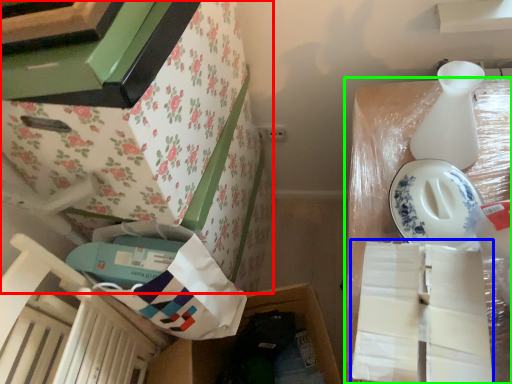
Question: Considering the real-world distances, which object is farthest from furniture (highlighted by a red box)? wrapping paper (highlighted by a blue box) or storage box (highlighted by a green box)?

Choices:
 (A) wrapping paper
 (B) storage box

Answer: (A)